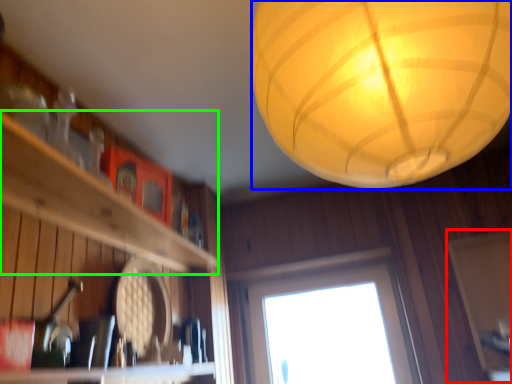
Question: Considering the real-world distances, which object is farthest from screen door (highlighted by a red box)? lantern (highlighted by a blue box) or shelf (highlighted by a green box)?

Choices:
 (A) lantern
 (B) shelf

Answer: (B)